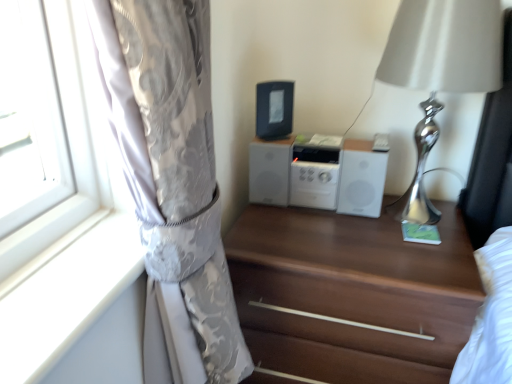
Question: Does brown wood chest of drawers at center have a greater height compared to black plastic radio at center?

Choices:
 (A) yes
 (B) no

Answer: (A)

Question: Is brown wood chest of drawers at center facing away from black plastic radio at center?

Choices:
 (A) yes
 (B) no

Answer: (B)

Question: Does brown wood chest of drawers at center have a greater width compared to black plastic radio at center?

Choices:
 (A) yes
 (B) no

Answer: (A)

Question: Is brown wood chest of drawers at center oriented towards black plastic radio at center?

Choices:
 (A) yes
 (B) no

Answer: (B)

Question: Can you confirm if brown wood chest of drawers at center is bigger than black plastic radio at center?

Choices:
 (A) no
 (B) yes

Answer: (B)

Question: Is white matte stereo at center taller or shorter than black plastic radio at center?

Choices:
 (A) short
 (B) tall

Answer: (B)

Question: From the image's perspective, is white matte stereo at center positioned above or below black plastic radio at center?

Choices:
 (A) below
 (B) above

Answer: (A)

Question: Relative to black plastic radio at center, is white matte stereo at center in front or behind?

Choices:
 (A) behind
 (B) front

Answer: (B)

Question: Is point (280, 175) positioned closer to the camera than point (268, 94)?

Choices:
 (A) farther
 (B) closer

Answer: (A)

Question: Is point (251, 233) positioned closer to the camera than point (477, 52)?

Choices:
 (A) closer
 (B) farther

Answer: (B)

Question: Considering their positions, is brown wood chest of drawers at center located in front of or behind silver metallic table lamp at right?

Choices:
 (A) front
 (B) behind

Answer: (B)

Question: In terms of width, does brown wood chest of drawers at center look wider or thinner when compared to silver metallic table lamp at right?

Choices:
 (A) thin
 (B) wide

Answer: (B)

Question: Would you say brown wood chest of drawers at center is to the left or to the right of silver metallic table lamp at right in the picture?

Choices:
 (A) left
 (B) right

Answer: (A)

Question: Is brown wood chest of drawers at center spatially inside white matte stereo at center, or outside of it?

Choices:
 (A) outside
 (B) inside

Answer: (A)

Question: Considering the positions of brown wood chest of drawers at center and white matte stereo at center in the image, is brown wood chest of drawers at center bigger or smaller than white matte stereo at center?

Choices:
 (A) small
 (B) big

Answer: (B)